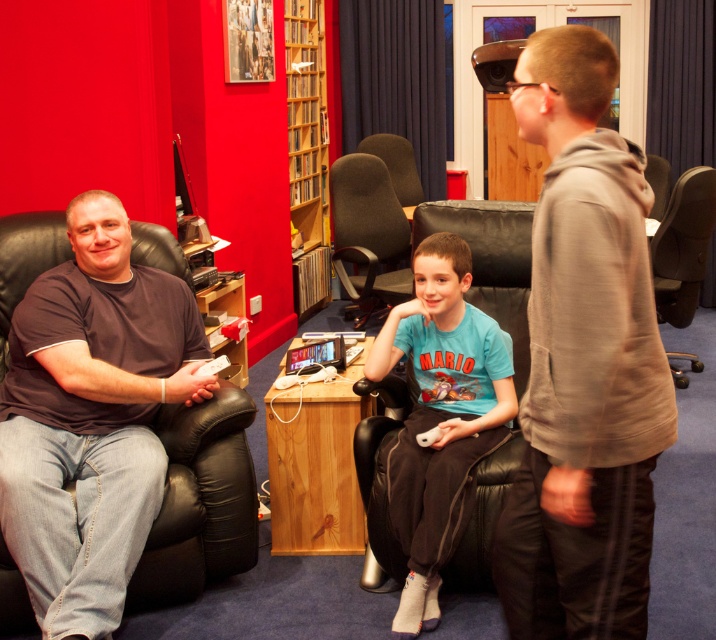
You are a delivery person who needs to place a small package between the light brown hoodie at right and the dark brown fabric chair at center. The package requires at least 10 feet of space to be placed safely. Can you fit it there?

The distance between the light brown hoodie at right and the dark brown fabric chair at center is 9.17 feet, which is less than the required 10 feet. Therefore, the package cannot be placed safely between them.

You are a delivery person who needs to place a large package on the tallest object in the room. Which object should you choose between the wooden bookshelf at upper center and the dark brown fabric chair at center?

The wooden bookshelf at upper center has a greater height compared to the dark brown fabric chair at center, so you should place the large package on the wooden bookshelf at upper center.

You are a delivery person who needs to place a small package between the light brown hoodie at right and the brown leather swivel chair at right. The package is 0.5 meters long. Can you fit the package in the space between them?

The distance between the light brown hoodie at right and the brown leather swivel chair at right is 2.74 meters, so yes, the package can fit as the space is larger than the package length.